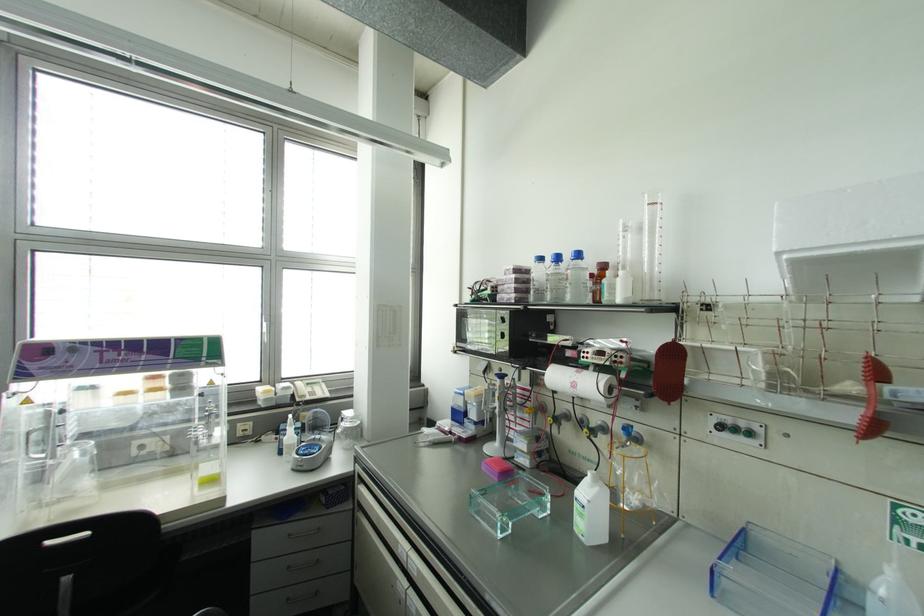
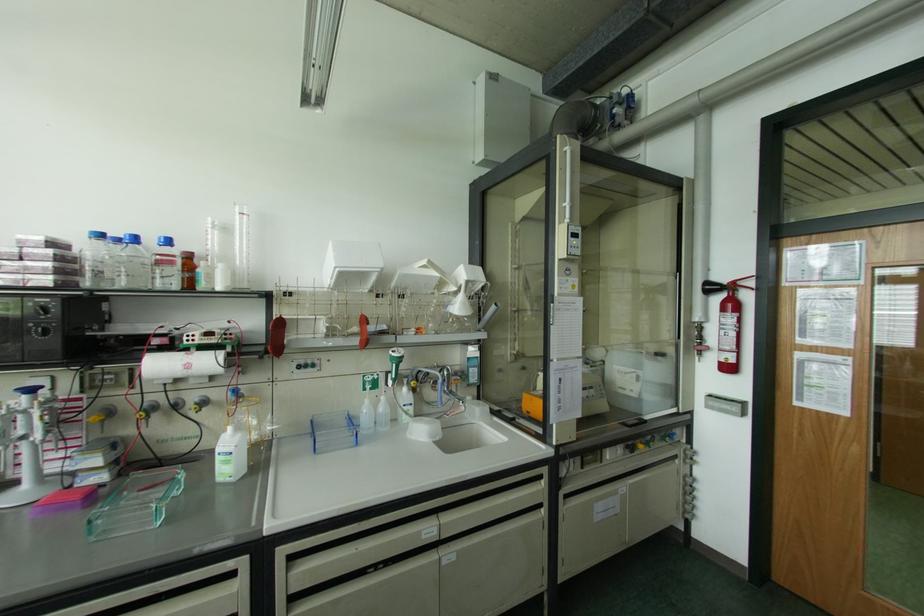
Find the pixel in the second image that matches pixel 502 336 in the first image.

(44, 333)